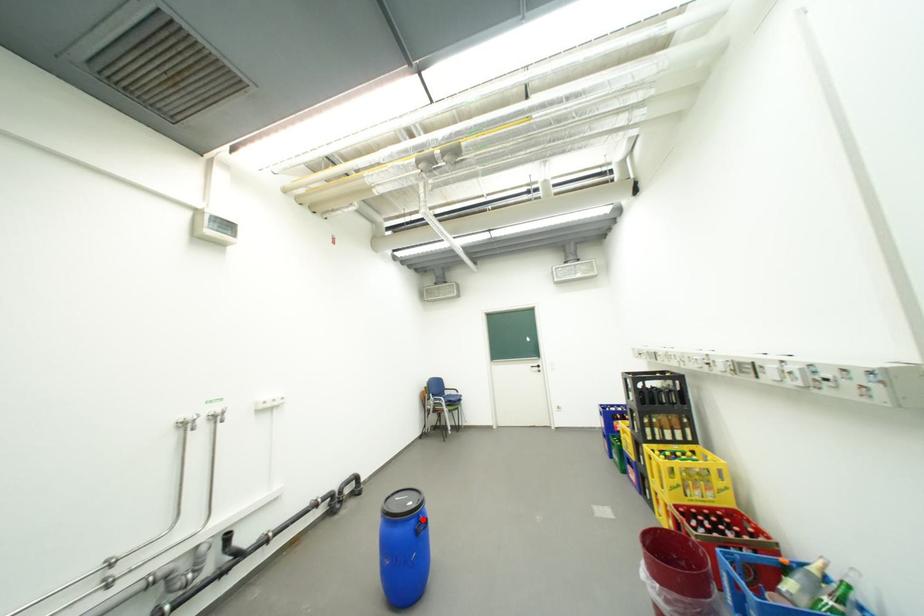
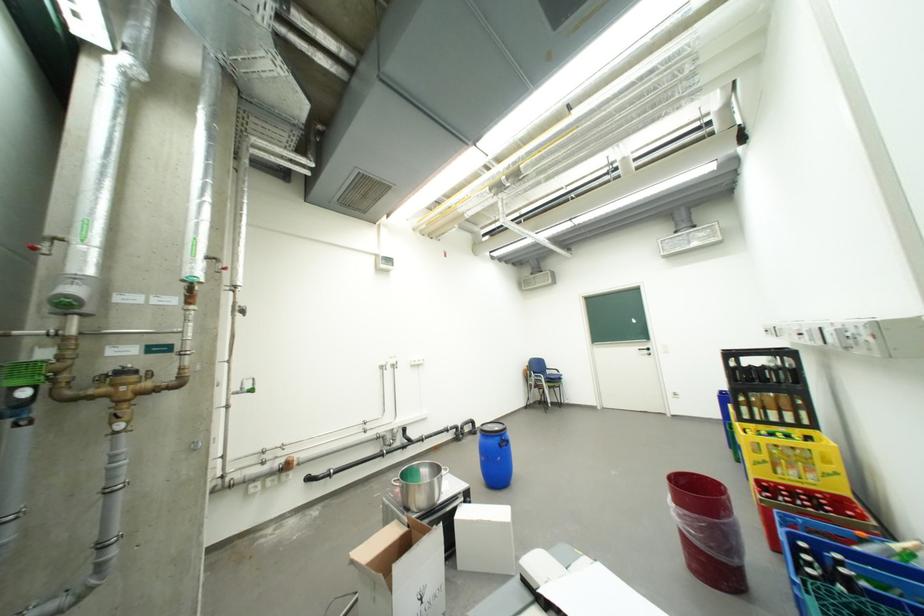
In the second image, find the point that corresponds to the highlighted location in the first image.

(507, 438)